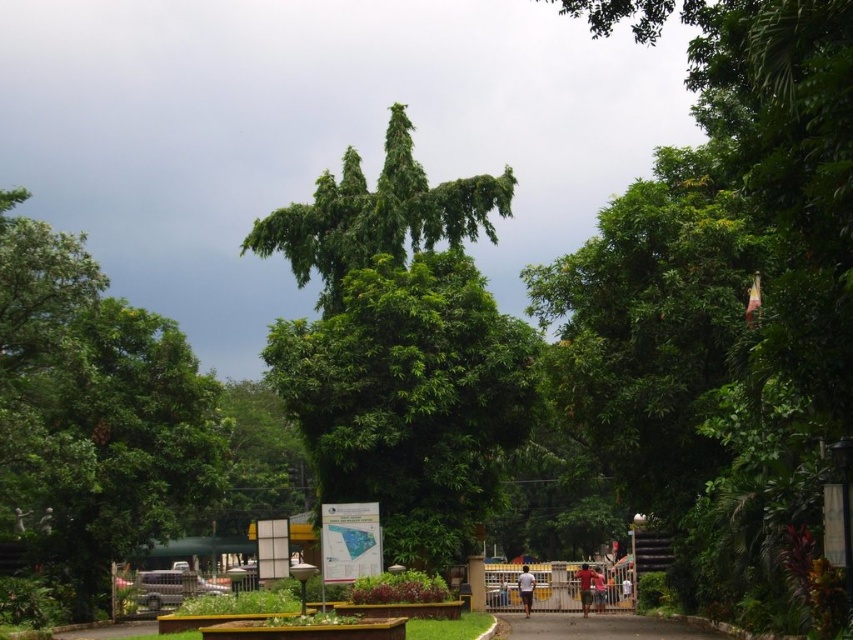
Question: In this image, where is green leafy tree at center located relative to green leafy tree at left?

Choices:
 (A) below
 (B) above

Answer: (B)

Question: Observing the image, what is the correct spatial positioning of red fabric shirt at center in reference to white fabric shirt at center?

Choices:
 (A) right
 (B) left

Answer: (A)

Question: Which point is farther to the camera?

Choices:
 (A) green leafy tree at center
 (B) white fabric shirt at center
 (C) red fabric shirt at center

Answer: (B)

Question: Estimate the real-world distances between objects in this image. Which object is farther from the white fabric shirt at center?

Choices:
 (A) green leafy tree at left
 (B) red fabric shirt at center
 (C) gray asphalt path at center
 (D) brown fabric shirt at center

Answer: (A)

Question: Can you confirm if green leafy tree at left is thinner than white fabric shirt at center?

Choices:
 (A) no
 (B) yes

Answer: (A)

Question: Considering the real-world distances, which object is closest to the white fabric shirt at center?

Choices:
 (A) brown fabric shirt at center
 (B) green leafy tree at center
 (C) red fabric shirt at center

Answer: (C)